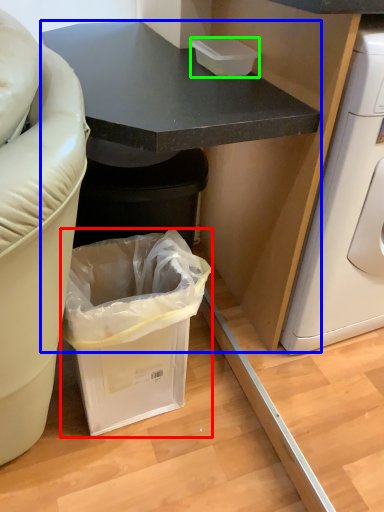
Question: Based on their relative distances, which object is farther from trash bin/can (highlighted by a red box)? Choose from cabinetry (highlighted by a blue box) and box (highlighted by a green box).

Choices:
 (A) cabinetry
 (B) box

Answer: (B)